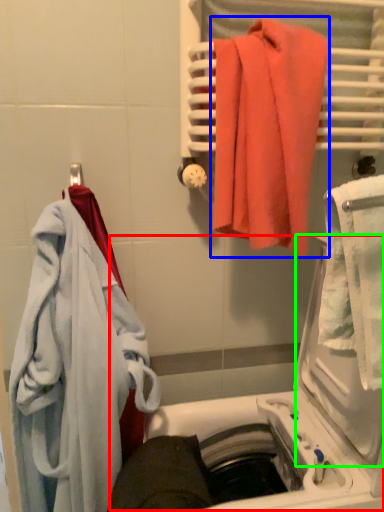
Question: Which object is positioned farthest from dish washer (highlighted by a red box)? Select from towel (highlighted by a blue box) and screen door (highlighted by a green box).

Choices:
 (A) towel
 (B) screen door

Answer: (A)